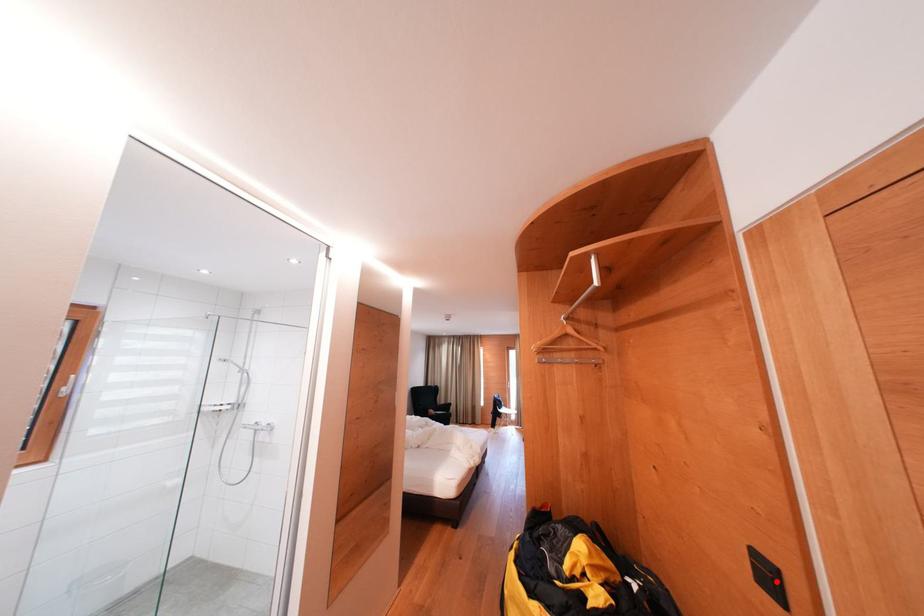
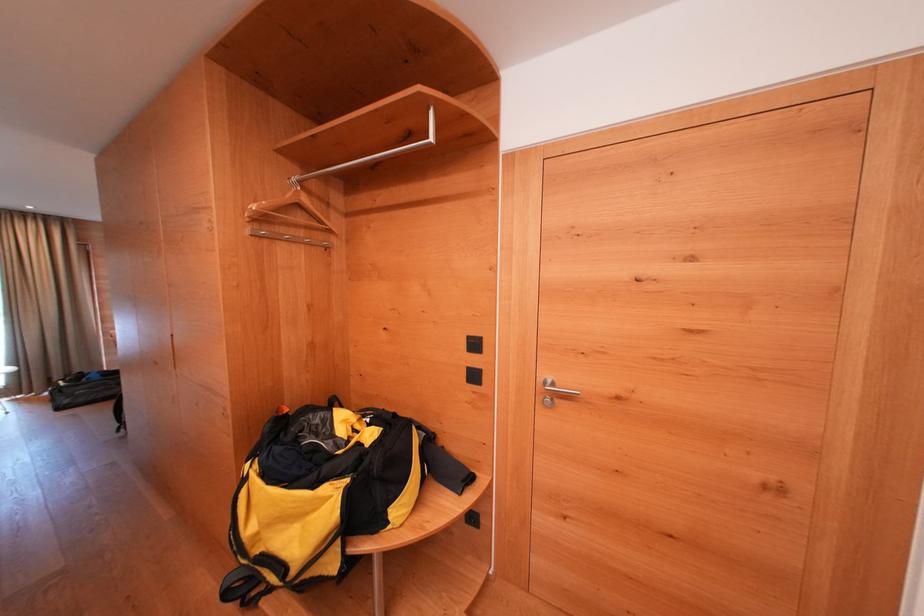
The point at the highlighted location is marked in the first image. Where is the corresponding point in the second image?

(481, 349)